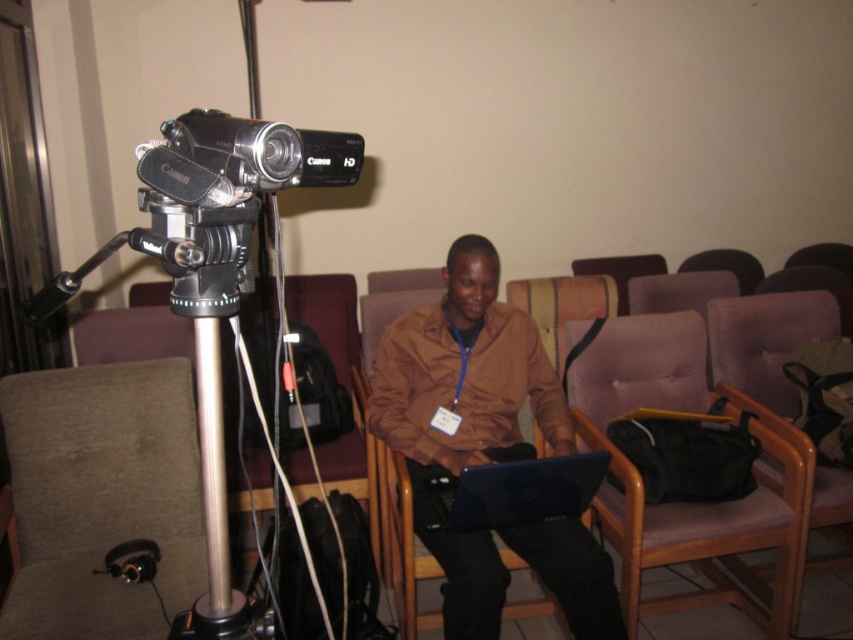
Can you confirm if brown matte shirt at center is wider than silver metallic tripod at left?

Indeed, brown matte shirt at center has a greater width compared to silver metallic tripod at left.

From the picture: Is brown matte shirt at center taller than silver metallic tripod at left?

A: Indeed, brown matte shirt at center has a greater height compared to silver metallic tripod at left.

Which is behind, point (451, 464) or point (218, 241)?

Point (451, 464)

Locate an element on the screen. This screenshot has height=640, width=853. brown matte shirt at center is located at coordinates (463, 416).

Can you confirm if brown matte shirt at center is positioned to the right of blue glossy laptop at center?

In fact, brown matte shirt at center is to the left of blue glossy laptop at center.

Can you confirm if brown matte shirt at center is wider than blue glossy laptop at center?

Indeed, brown matte shirt at center has a greater width compared to blue glossy laptop at center.

Is point (491, 397) farther from camera compared to point (474, 486)?

Yes, point (491, 397) is behind point (474, 486).

Where is `brown matte shirt at center`? The width and height of the screenshot is (853, 640). brown matte shirt at center is located at coordinates (463, 416).

Does brown matte shirt at center appear on the right side of silver metallic pole at center?

Correct, you'll find brown matte shirt at center to the right of silver metallic pole at center.

Between point (480, 547) and point (218, 387), which one is positioned in front?

Point (218, 387)

The width and height of the screenshot is (853, 640). I want to click on brown matte shirt at center, so click(463, 416).